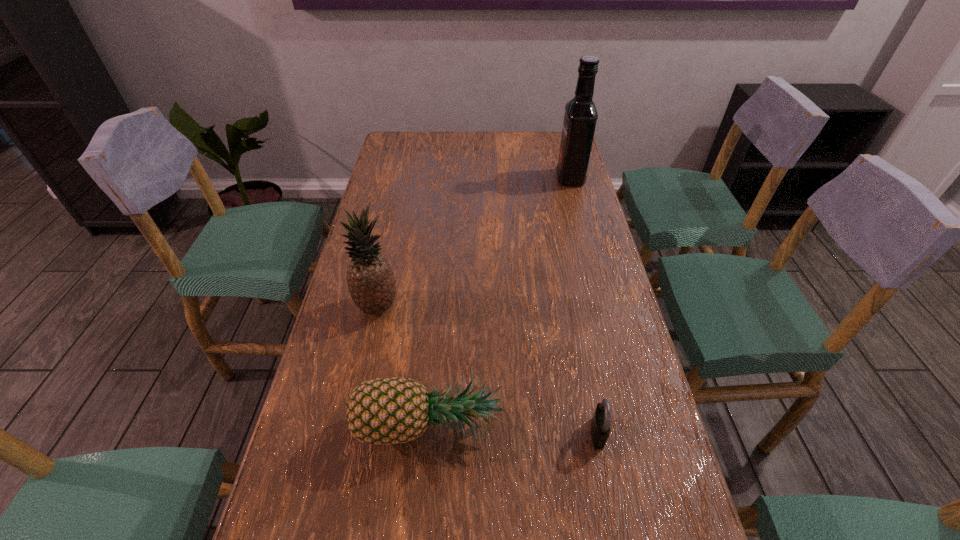
The width and height of the screenshot is (960, 540). In order to click on the rightmost object in this screenshot , I will do `click(580, 117)`.

Locate an element on the screen. the tallest object is located at coordinates tap(580, 117).

You are a GUI agent. You are given a task and a screenshot of the screen. Output one action in this format:
    pyautogui.click(x=<x>, y=<y>)
    Task: Click on the taller pineapple
    This screenshot has height=540, width=960.
    Given the screenshot: What is the action you would take?
    pyautogui.click(x=370, y=279)

Locate an element on the screen. the second farthest object is located at coordinates (370, 279).

The height and width of the screenshot is (540, 960). Identify the location of the nearer pineapple. (387, 411).

Identify the location of the shorter pineapple. (387, 411).

Image resolution: width=960 pixels, height=540 pixels. In order to click on the shortest object in this screenshot , I will do `click(600, 426)`.

What are the coordinates of `the second object from right to left` in the screenshot? It's located at (600, 426).

Where is `vacant space located 0.280m on the front-facing side of the farthest object`? vacant space located 0.280m on the front-facing side of the farthest object is located at coordinates (478, 178).

Locate an element on the screen. The height and width of the screenshot is (540, 960). vacant space situated 0.370m on the front-facing side of the farthest object is located at coordinates (453, 178).